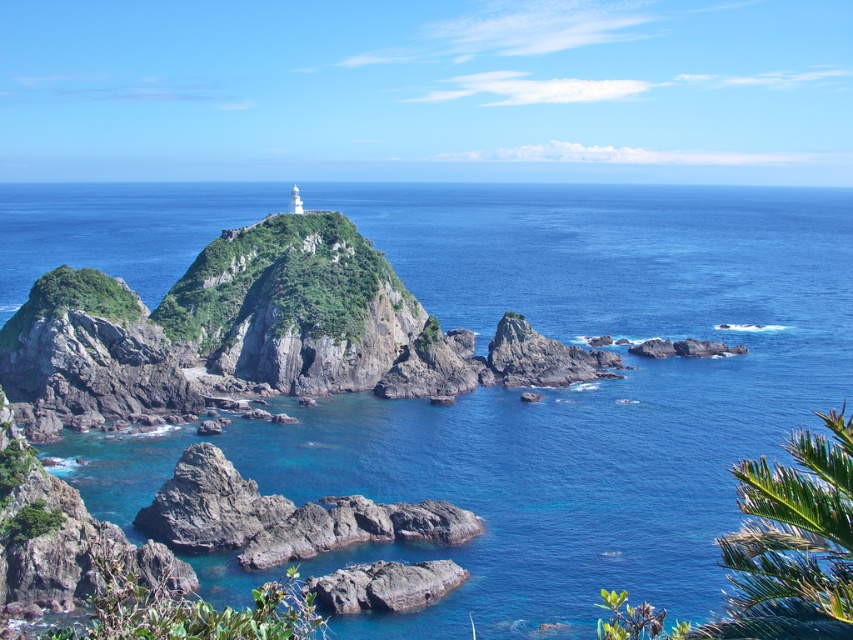
Question: Among these objects, which one is farthest from the camera?

Choices:
 (A) blue clear water at center
 (B) rough gray rock at lower center

Answer: (B)

Question: Is green leafy palm tree at lower right above rough gray rock at lower center?

Choices:
 (A) no
 (B) yes

Answer: (B)

Question: Which point is closer to the camera?

Choices:
 (A) rough gray rock at lower center
 (B) blue clear water at center
 (C) green leafy palm tree at lower right

Answer: (C)

Question: Is green leafy palm tree at lower right wider than rough gray rock at lower center?

Choices:
 (A) no
 (B) yes

Answer: (B)

Question: Is blue clear water at center wider than rough gray rock at lower center?

Choices:
 (A) no
 (B) yes

Answer: (B)

Question: Which point is farther from the camera taking this photo?

Choices:
 (A) (386, 596)
 (B) (817, 604)
 (C) (816, 211)

Answer: (C)